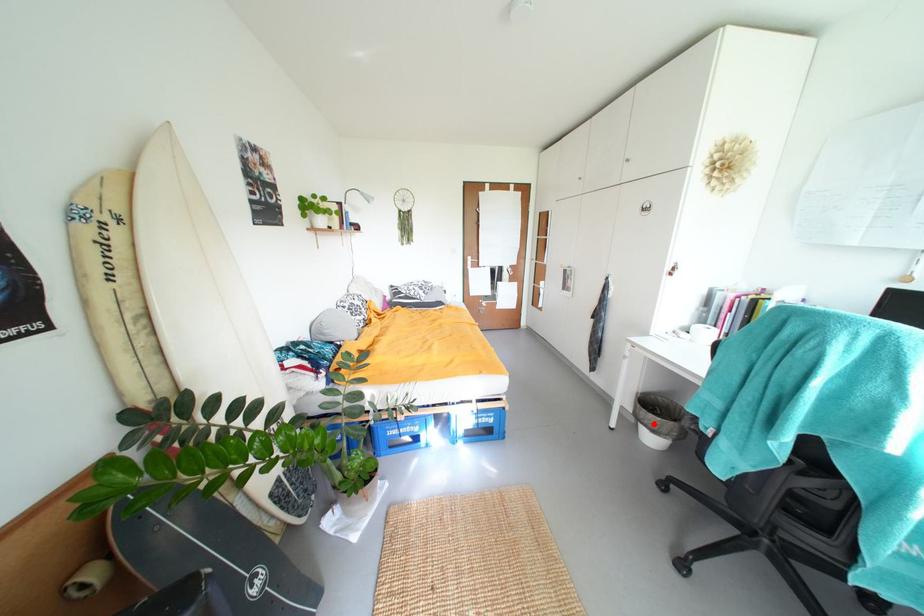
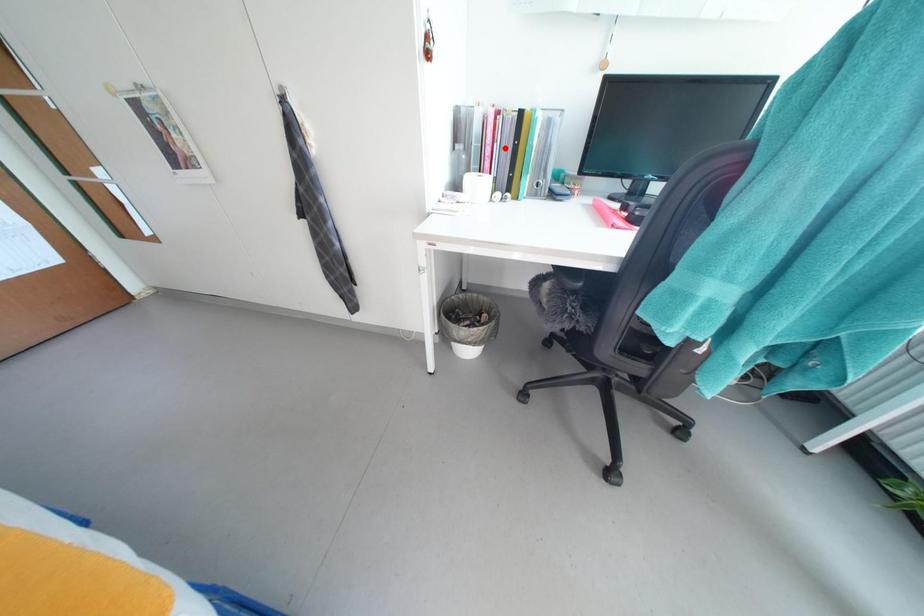
I am providing you with two images of the same scene from different viewpoints. A red point is marked on the first image and another point is marked on the second image. Is the red point in image1 aligned with the point shown in image2?

No